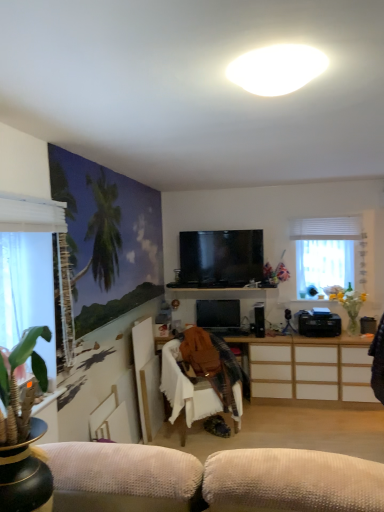
Question: Is translucent glass vase at right in front of white fabric chair at center?

Choices:
 (A) no
 (B) yes

Answer: (A)

Question: Is translucent glass vase at right outside white fabric chair at center?

Choices:
 (A) no
 (B) yes

Answer: (B)

Question: Can you confirm if translucent glass vase at right is thinner than white fabric chair at center?

Choices:
 (A) yes
 (B) no

Answer: (A)

Question: Is translucent glass vase at right facing towards white fabric chair at center?

Choices:
 (A) yes
 (B) no

Answer: (B)

Question: Is translucent glass vase at right with white fabric chair at center?

Choices:
 (A) no
 (B) yes

Answer: (A)

Question: From a real-world perspective, relative to white matte oval light at upper center, is white sheer curtain at left, the second window viewed from the back, vertically above or below?

Choices:
 (A) below
 (B) above

Answer: (A)

Question: Is white sheer curtain at left, placed as the second window when sorted from right to left, bigger or smaller than white matte oval light at upper center?

Choices:
 (A) big
 (B) small

Answer: (A)

Question: Considering the positions of white sheer curtain at left, which ranks as the first window in front-to-back order, and white matte oval light at upper center in the image, is white sheer curtain at left, which ranks as the first window in front-to-back order, wider or thinner than white matte oval light at upper center?

Choices:
 (A) thin
 (B) wide

Answer: (A)

Question: Is white sheer curtain at left, positioned as the first window in left-to-right order, in front of or behind white matte oval light at upper center in the image?

Choices:
 (A) front
 (B) behind

Answer: (B)

Question: Would you say flat screen tv at center, marked as the 2th television in a bottom-to-top arrangement, is to the left or to the right of white sheer curtain at right, acting as the second window starting from the left, in the picture?

Choices:
 (A) right
 (B) left

Answer: (B)

Question: Is flat screen tv at center, the first television from the top, bigger or smaller than white sheer curtain at right, which is the second window in front-to-back order?

Choices:
 (A) small
 (B) big

Answer: (B)

Question: Considering the positions of flat screen tv at center, marked as the 2th television in a bottom-to-top arrangement, and white sheer curtain at right, acting as the second window starting from the left, in the image, is flat screen tv at center, marked as the 2th television in a bottom-to-top arrangement, taller or shorter than white sheer curtain at right, acting as the second window starting from the left,?

Choices:
 (A) tall
 (B) short

Answer: (B)

Question: Is flat screen tv at center, marked as the 2th television in a bottom-to-top arrangement, situated inside white sheer curtain at right, the 1th window positioned from the right, or outside?

Choices:
 (A) inside
 (B) outside

Answer: (B)

Question: Considering the positions of white wood cabinet at center and white sheer curtain at right in the image, is white wood cabinet at center wider or thinner than white sheer curtain at right?

Choices:
 (A) thin
 (B) wide

Answer: (B)

Question: Based on their positions, is white wood cabinet at center located to the left or right of white sheer curtain at right?

Choices:
 (A) left
 (B) right

Answer: (A)